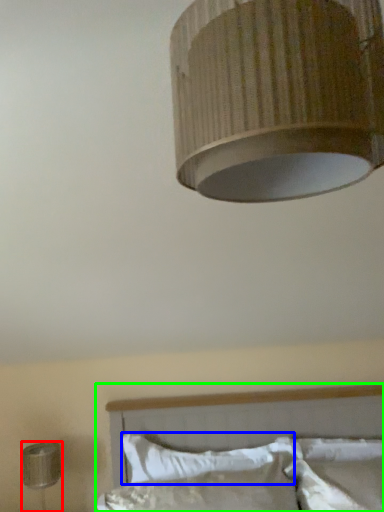
Question: Based on their relative distances, which object is farther from lamp (highlighted by a red box)? Choose from pillow (highlighted by a blue box) and bed (highlighted by a green box).

Choices:
 (A) pillow
 (B) bed

Answer: (B)